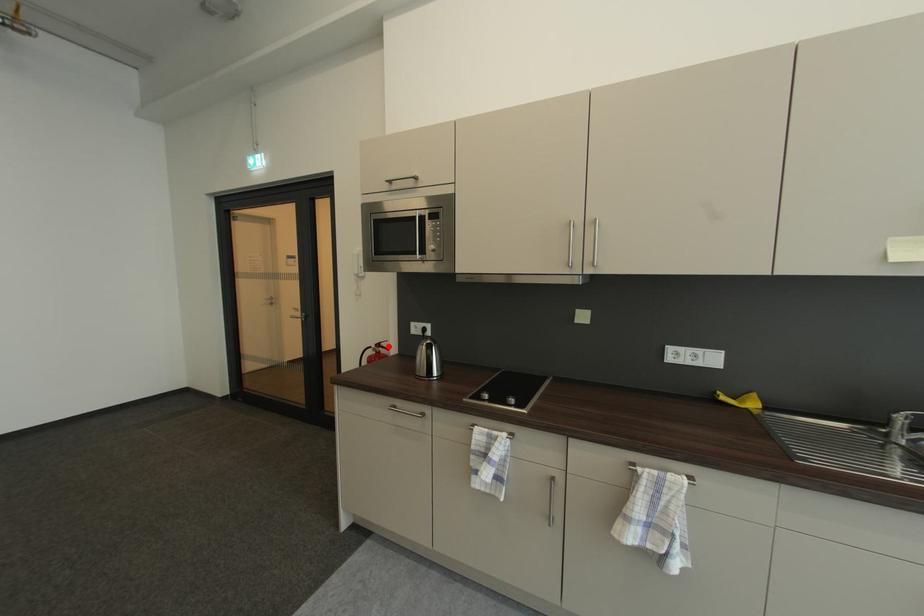
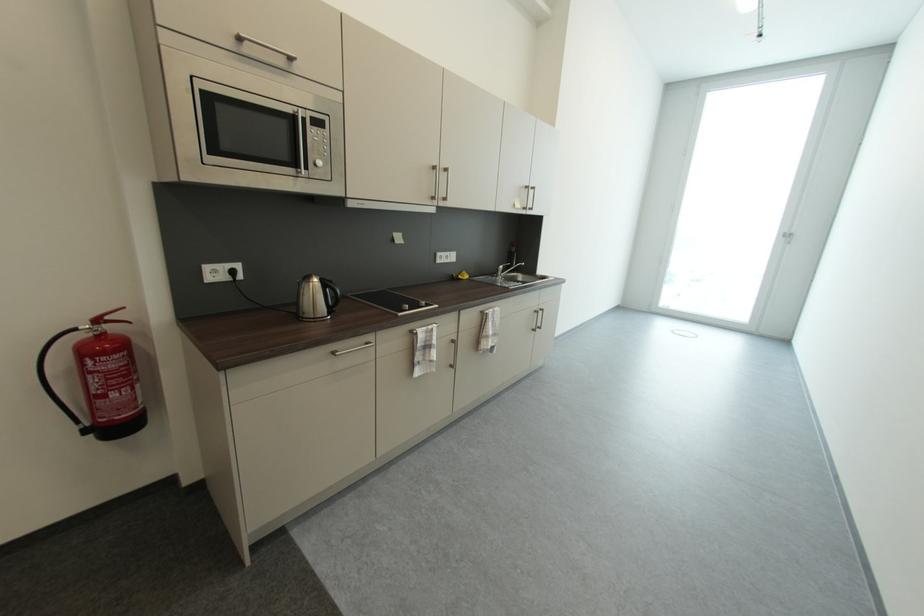
The point at the highlighted location is marked in the first image. Where is the corresponding point in the second image?

(116, 318)